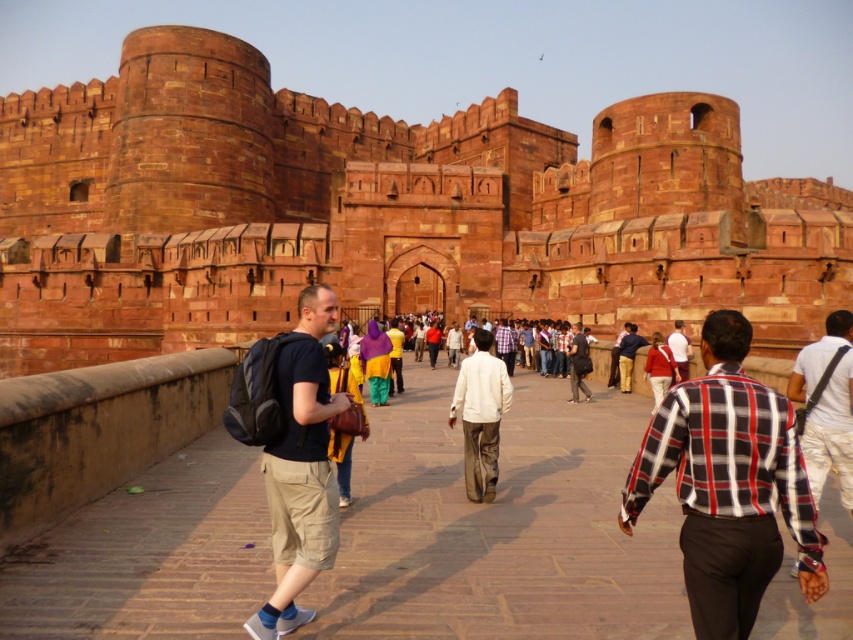
You are a photographer standing at the entrance of the fort. You notice a tourist wearing a dark blue tshirt at center. Where should you position your camera to capture the point at (300,467) on the tourist?

The point at (300,467) is on the dark blue tshirt at center, so you should position your camera to aim at the dark blue tshirt at center to capture that point.